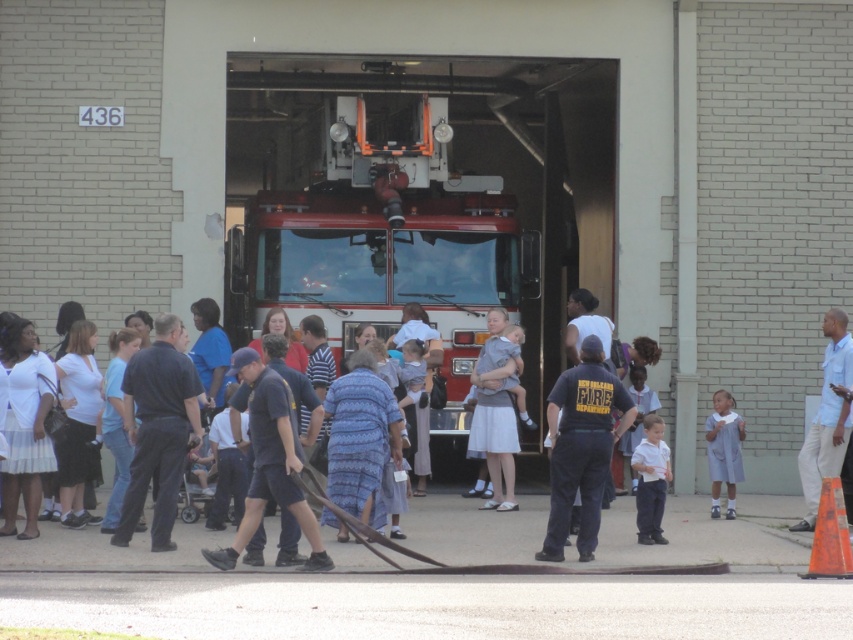
Is dark blue uniform at center positioned before light blue shirt at center?

Yes, dark blue uniform at center is in front of light blue shirt at center.

Find the location of a particular element. The image size is (853, 640). dark blue uniform at center is located at coordinates (581, 445).

Is dark blue uniform at center taller than white matte shirt at center?

Yes.

Is dark blue uniform at center positioned in front of white matte shirt at center?

Yes.

Is point (555, 451) closer to viewer compared to point (640, 515)?

Yes, point (555, 451) is in front of point (640, 515).

This screenshot has width=853, height=640. I want to click on dark blue uniform at center, so click(581, 445).

Is light blue shirt at center shorter than light blue fabric dress at center?

Indeed, light blue shirt at center has a lesser height compared to light blue fabric dress at center.

Which of these two, light blue shirt at center or light blue fabric dress at center, stands taller?

Standing taller between the two is light blue fabric dress at center.

Find the location of a particular element. The width and height of the screenshot is (853, 640). light blue shirt at center is located at coordinates (827, 419).